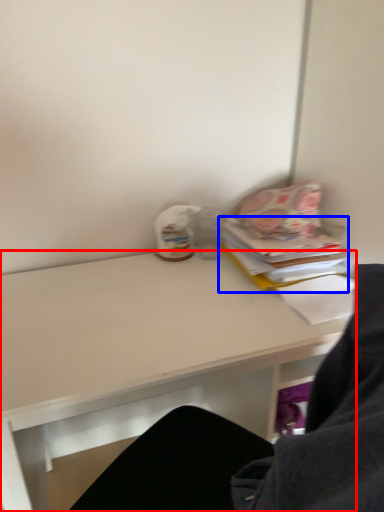
Question: Which object appears farthest to the camera in this image, desk (highlighted by a red box) or paperback book (highlighted by a blue box)?

Choices:
 (A) desk
 (B) paperback book

Answer: (B)